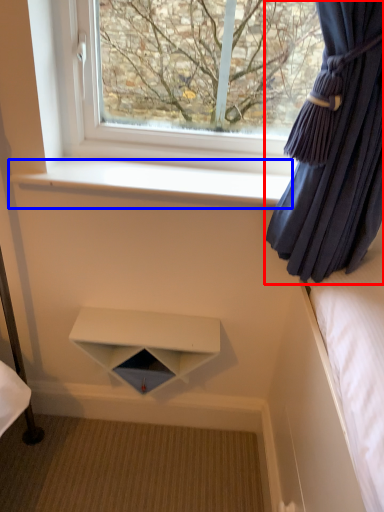
Question: Which point is closer to the camera, curtain (highlighted by a red box) or window sill (highlighted by a blue box)?

Choices:
 (A) curtain
 (B) window sill

Answer: (A)